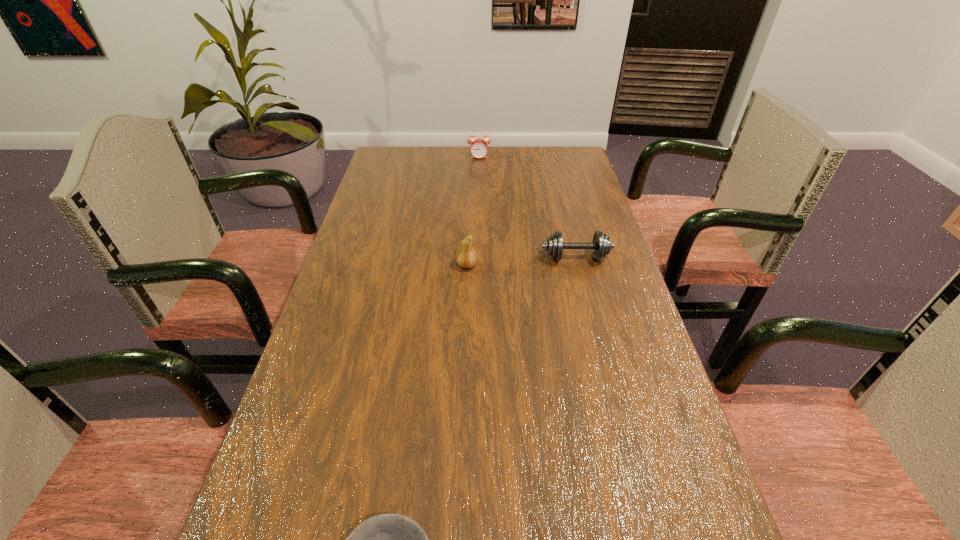
Identify the location of vacant space at the right edge of the desktop. The height and width of the screenshot is (540, 960). (553, 188).

What are the coordinates of `free point at the far right corner` in the screenshot? It's located at (568, 164).

Find the location of a particular element. The image size is (960, 540). vacant area that lies between the pear and the dumbbell is located at coordinates (521, 261).

Identify the location of vacant area between the rightmost object and the pear. The width and height of the screenshot is (960, 540). click(521, 261).

Locate an element on the screen. vacant area that lies between the pear and the farthest object is located at coordinates (473, 211).

Identify the location of free space between the rightmost object and the farthest object. Image resolution: width=960 pixels, height=540 pixels. (527, 207).

You are a GUI agent. You are given a task and a screenshot of the screen. Output one action in this format:
    pyautogui.click(x=<x>, y=<y>)
    Task: Click on the free space that is in between the rightmost object and the alarm clock
    The height and width of the screenshot is (540, 960).
    Given the screenshot: What is the action you would take?
    pyautogui.click(x=527, y=207)

What are the coordinates of `object that is the closest one to the pear` in the screenshot? It's located at (601, 245).

Select which object is the closest to the alarm clock. Please provide its 2D coordinates. Your answer should be formatted as a tuple, i.e. [(x, y)], where the tuple contains the x and y coordinates of a point satisfying the conditions above.

[(601, 245)]

Identify the location of vacant space that satisfies the following two spatial constraints: 1. on the back side of the dumbbell; 2. on the left side of the pear. (467, 258).